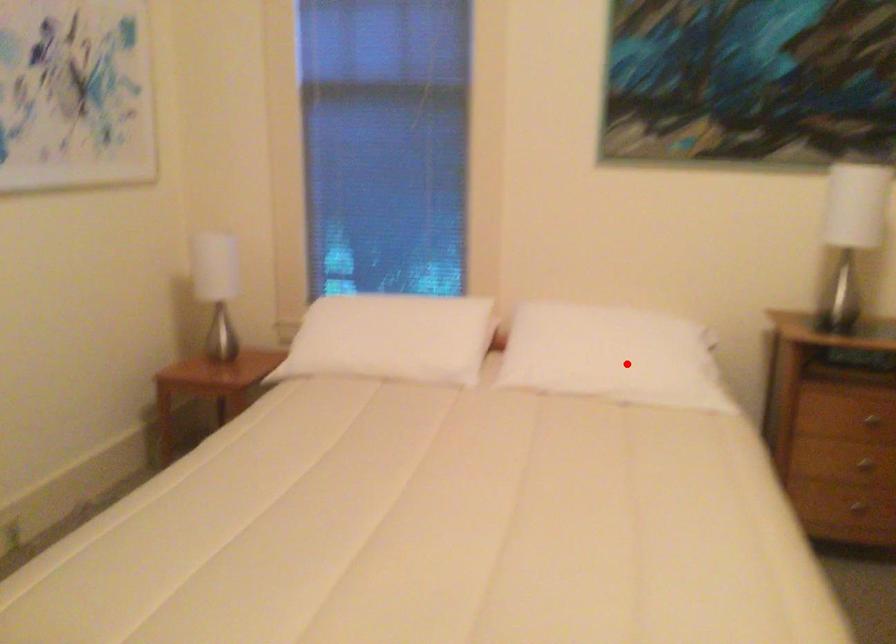
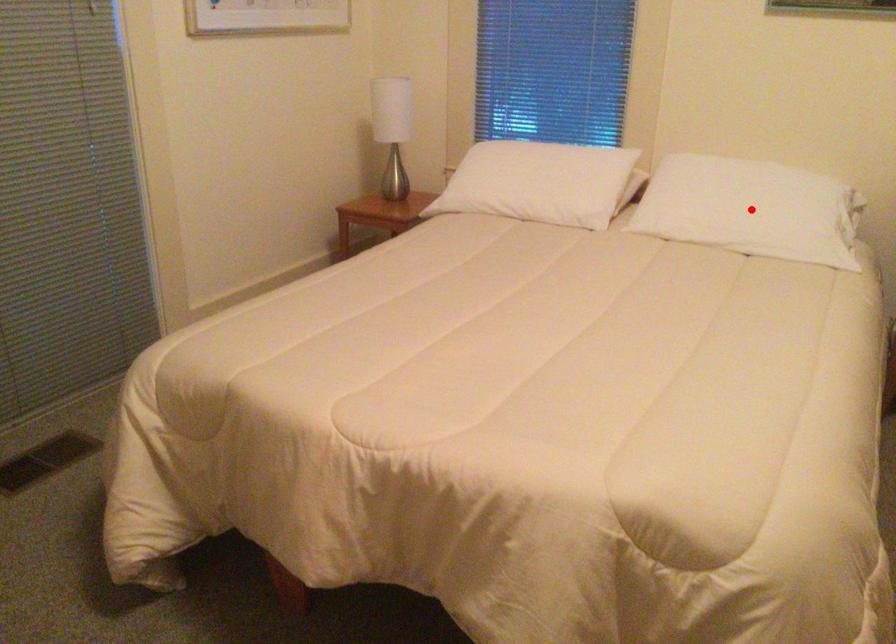
I am providing you with two images of the same scene from different viewpoints. A red point is marked on the first image and another point is marked on the second image. Does the point marked in image1 correspond to the same location as the one in image2?

Yes